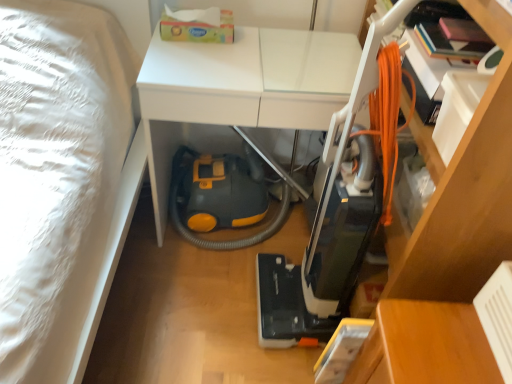
Image resolution: width=512 pixels, height=384 pixels. What are the coordinates of `wooden table at lower right, positioned as the 2th table in left-to-right order` in the screenshot? It's located at (425, 346).

What are the coordinates of `white glossy table at center, placed as the 1th table when sorted from top to bottom` in the screenshot? It's located at (239, 90).

At what (x,y) coordinates should I click in order to perform the action: click on wooden table at lower right, the second table viewed from the top. Please return your answer as a coordinate pair (x, y). The width and height of the screenshot is (512, 384). Looking at the image, I should click on (425, 346).

From a real-world perspective, is orange corded vacuum cleaner at center located higher than white glossy table at center, which is the 2th table from bottom to top?

Yes, from a real-world perspective, orange corded vacuum cleaner at center is above white glossy table at center, which is the 2th table from bottom to top.

Where is `vacuum to the right of white glossy table at center, positioned as the second table in right-to-left order`? The height and width of the screenshot is (384, 512). vacuum to the right of white glossy table at center, positioned as the second table in right-to-left order is located at coordinates (331, 221).

Is orange corded vacuum cleaner at center inside or outside of white glossy table at center, positioned as the second table in right-to-left order?

orange corded vacuum cleaner at center lies outside white glossy table at center, positioned as the second table in right-to-left order.

Does point (453, 366) appear closer or farther from the camera than point (166, 60)?

Point (453, 366) appears to be closer to the viewer than point (166, 60).

Can you confirm if wooden table at lower right, positioned as the 2th table in left-to-right order, is smaller than white glossy table at center, the 1th table positioned from the left?

Yes.

Locate an element on the screen. This screenshot has width=512, height=384. table that is on the right side of white glossy table at center, positioned as the second table in right-to-left order is located at coordinates [425, 346].

Considering the sizes of orange corded vacuum cleaner at center and wooden table at lower right, marked as the first table in a right-to-left arrangement, in the image, is orange corded vacuum cleaner at center taller or shorter than wooden table at lower right, marked as the first table in a right-to-left arrangement,?

In the image, orange corded vacuum cleaner at center appears to be taller than wooden table at lower right, marked as the first table in a right-to-left arrangement.

Is orange corded vacuum cleaner at center not within wooden table at lower right, placed as the 1th table when sorted from bottom to top?

Yes, orange corded vacuum cleaner at center is outside of wooden table at lower right, placed as the 1th table when sorted from bottom to top.

Which is behind, point (260, 317) or point (396, 320)?

The point (260, 317) is more distant.

In the scene shown: From the image's perspective, would you say orange corded vacuum cleaner at center is shown under wooden table at lower right, placed as the 1th table when sorted from bottom to top?

No, from the image's perspective, orange corded vacuum cleaner at center is not below wooden table at lower right, placed as the 1th table when sorted from bottom to top.

Locate an element on the screen. The width and height of the screenshot is (512, 384). table below the white glossy table at center, positioned as the second table in right-to-left order (from the image's perspective) is located at coordinates (425, 346).

Considering the positions of point (303, 104) and point (378, 365), is point (303, 104) closer or farther from the camera than point (378, 365)?

Point (303, 104).

From the image's perspective, does white glossy table at center, which is the 2th table from bottom to top, appear lower than wooden table at lower right, the second table viewed from the top?

No, from the image's perspective, white glossy table at center, which is the 2th table from bottom to top, is not beneath wooden table at lower right, the second table viewed from the top.

Could you measure the distance between white glossy table at center, the 1th table positioned from the left, and wooden table at lower right, the second table viewed from the top?

white glossy table at center, the 1th table positioned from the left, is 74.29 centimeters away from wooden table at lower right, the second table viewed from the top.

Considering the positions of point (477, 355) and point (357, 254), is point (477, 355) closer or farther from the camera than point (357, 254)?

Point (477, 355).

Who is bigger, wooden table at lower right, placed as the 1th table when sorted from bottom to top, or orange corded vacuum cleaner at center?

Bigger between the two is orange corded vacuum cleaner at center.

Which object is further away from the camera, wooden table at lower right, the second table viewed from the top, or orange corded vacuum cleaner at center?

wooden table at lower right, the second table viewed from the top, is behind.

Identify the location of table that is on the left side of orange corded vacuum cleaner at center. This screenshot has height=384, width=512. (239, 90).

From the image's perspective, which is above, white glossy table at center, placed as the 1th table when sorted from top to bottom, or orange corded vacuum cleaner at center?

white glossy table at center, placed as the 1th table when sorted from top to bottom, appears higher in the image.

Considering the relative sizes of white glossy table at center, placed as the 1th table when sorted from top to bottom, and orange corded vacuum cleaner at center in the image provided, is white glossy table at center, placed as the 1th table when sorted from top to bottom, bigger than orange corded vacuum cleaner at center?

Correct, white glossy table at center, placed as the 1th table when sorted from top to bottom, is larger in size than orange corded vacuum cleaner at center.

How many degrees apart are the facing directions of white glossy table at center, placed as the 1th table when sorted from top to bottom, and orange corded vacuum cleaner at center?

The angle between the facing direction of white glossy table at center, placed as the 1th table when sorted from top to bottom, and the facing direction of orange corded vacuum cleaner at center is 90 degrees.

Where is `the 1st table positioned below the orange corded vacuum cleaner at center (from a real-world perspective)`? The height and width of the screenshot is (384, 512). the 1st table positioned below the orange corded vacuum cleaner at center (from a real-world perspective) is located at coordinates (239, 90).

Locate an element on the screen. The width and height of the screenshot is (512, 384). table that appears on the left of wooden table at lower right, placed as the 1th table when sorted from bottom to top is located at coordinates (239, 90).

Which object lies nearer to the anchor point white glossy table at center, positioned as the second table in right-to-left order, orange corded vacuum cleaner at center or wooden table at lower right, placed as the 1th table when sorted from bottom to top?

orange corded vacuum cleaner at center is closer to white glossy table at center, positioned as the second table in right-to-left order.

Looking at the image, which one is located closer to wooden table at lower right, the second table viewed from the top, orange corded vacuum cleaner at center or white glossy table at center, which is the 2th table from bottom to top?

orange corded vacuum cleaner at center is closer to wooden table at lower right, the second table viewed from the top.

Consider the image. Based on their spatial positions, is white glossy table at center, placed as the 1th table when sorted from top to bottom, or wooden table at lower right, placed as the 1th table when sorted from bottom to top, closer to orange corded vacuum cleaner at center?

wooden table at lower right, placed as the 1th table when sorted from bottom to top, is closer to orange corded vacuum cleaner at center.

Estimate the real-world distances between objects in this image. Which object is closer to orange corded vacuum cleaner at center, wooden table at lower right, placed as the 1th table when sorted from bottom to top, or white glossy table at center, placed as the 1th table when sorted from top to bottom?

wooden table at lower right, placed as the 1th table when sorted from bottom to top, is positioned closer to the anchor orange corded vacuum cleaner at center.

When comparing their distances from wooden table at lower right, the second table viewed from the top, does white glossy table at center, positioned as the second table in right-to-left order, or orange corded vacuum cleaner at center seem closer?

Based on the image, orange corded vacuum cleaner at center appears to be nearer to wooden table at lower right, the second table viewed from the top.

When comparing their distances from white glossy table at center, placed as the 1th table when sorted from top to bottom, does wooden table at lower right, the second table viewed from the top, or orange corded vacuum cleaner at center seem further?

Based on the image, wooden table at lower right, the second table viewed from the top, appears to be further to white glossy table at center, placed as the 1th table when sorted from top to bottom.

What are the coordinates of `vacuum between white glossy table at center, which is the 2th table from bottom to top, and wooden table at lower right, the second table viewed from the top, vertically` in the screenshot? It's located at (331, 221).